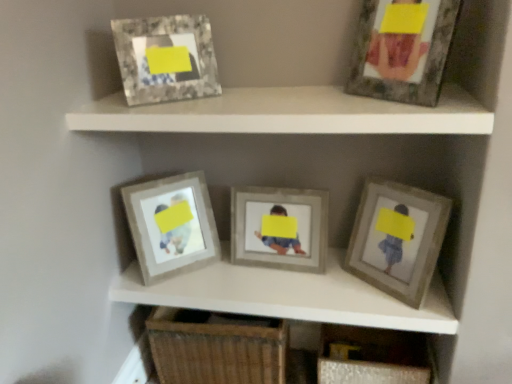
Question: Is matte gray frame at upper right, which ranks as the 2th picture frame in right-to-left order, thinner than woven wood drawer at lower center?

Choices:
 (A) yes
 (B) no

Answer: (A)

Question: Is matte gray frame at upper right, marked as the fourth picture frame in a left-to-right arrangement, far away from woven wood drawer at lower center?

Choices:
 (A) yes
 (B) no

Answer: (A)

Question: Is matte gray frame at upper right, marked as the fourth picture frame in a left-to-right arrangement, facing away from woven wood drawer at lower center?

Choices:
 (A) yes
 (B) no

Answer: (B)

Question: From a real-world perspective, is matte gray frame at upper right, marked as the fourth picture frame in a left-to-right arrangement, positioned over woven wood drawer at lower center based on gravity?

Choices:
 (A) no
 (B) yes

Answer: (B)

Question: Considering the relative sizes of matte gray frame at upper right, marked as the fourth picture frame in a left-to-right arrangement, and woven wood drawer at lower center in the image provided, is matte gray frame at upper right, marked as the fourth picture frame in a left-to-right arrangement, bigger than woven wood drawer at lower center?

Choices:
 (A) yes
 (B) no

Answer: (B)

Question: Is point (129, 193) positioned closer to the camera than point (352, 82)?

Choices:
 (A) closer
 (B) farther

Answer: (B)

Question: In the image, is wooden frame at center, the 5th picture frame when ordered from right to left, on the left side or the right side of matte gray frame at upper right, which ranks as the 2th picture frame in right-to-left order?

Choices:
 (A) left
 (B) right

Answer: (A)

Question: Based on their sizes in the image, would you say wooden frame at center, positioned as the first picture frame in left-to-right order, is bigger or smaller than matte gray frame at upper right, marked as the fourth picture frame in a left-to-right arrangement?

Choices:
 (A) small
 (B) big

Answer: (B)

Question: From a real-world perspective, relative to matte gray frame at upper right, marked as the fourth picture frame in a left-to-right arrangement, is wooden frame at center, positioned as the first picture frame in left-to-right order, vertically above or below?

Choices:
 (A) below
 (B) above

Answer: (A)

Question: Considering their positions, is matte gray frame at upper right, marked as the fourth picture frame in a left-to-right arrangement, located in front of or behind matte gray frame at center?

Choices:
 (A) front
 (B) behind

Answer: (A)

Question: Would you say matte gray frame at upper right, which ranks as the 2th picture frame in right-to-left order, is to the left or to the right of matte gray frame at center in the picture?

Choices:
 (A) left
 (B) right

Answer: (B)

Question: Looking at the image, does matte gray frame at upper right, which ranks as the 2th picture frame in right-to-left order, seem bigger or smaller compared to matte gray frame at center?

Choices:
 (A) small
 (B) big

Answer: (A)

Question: Is matte gray frame at upper right, marked as the fourth picture frame in a left-to-right arrangement, spatially inside matte gray frame at center, or outside of it?

Choices:
 (A) inside
 (B) outside

Answer: (B)

Question: Is matte gray frame at center right, the 1th picture frame positioned from the right, in front of or behind woven wood drawer at lower center in the image?

Choices:
 (A) front
 (B) behind

Answer: (A)

Question: Considering the positions of matte gray frame at center right, which appears as the fifth picture frame when viewed from the left, and woven wood drawer at lower center in the image, is matte gray frame at center right, which appears as the fifth picture frame when viewed from the left, bigger or smaller than woven wood drawer at lower center?

Choices:
 (A) small
 (B) big

Answer: (A)